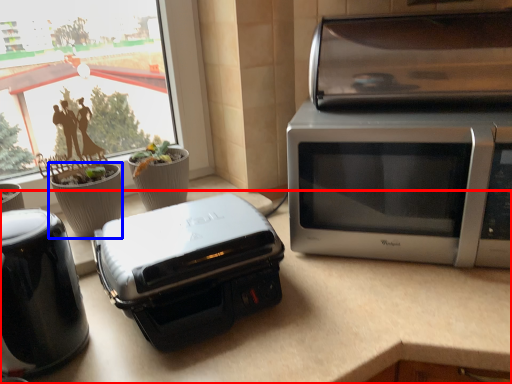
Question: Among these objects, which one is farthest to the camera, counter top (highlighted by a red box) or flowerpot (highlighted by a blue box)?

Choices:
 (A) counter top
 (B) flowerpot

Answer: (B)